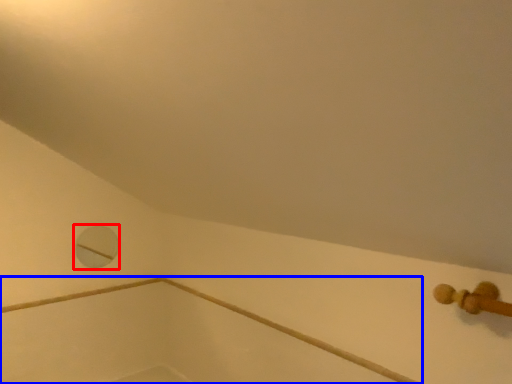
Question: Which of the following is the farthest to the observer, hole (highlighted by a red box) or bath (highlighted by a blue box)?

Choices:
 (A) hole
 (B) bath

Answer: (A)